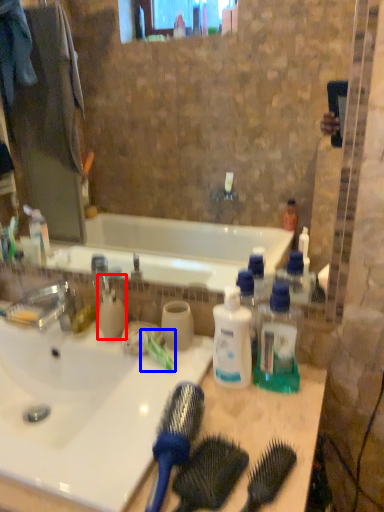
Question: Which object appears closest to the camera in this image, cleaning product (highlighted by a red box) or toothbrush (highlighted by a blue box)?

Choices:
 (A) cleaning product
 (B) toothbrush

Answer: (B)